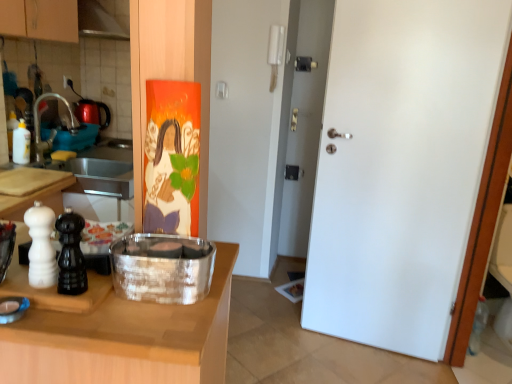
This screenshot has width=512, height=384. Find the location of `free space to the left of silver metallic container at center`. free space to the left of silver metallic container at center is located at coordinates (78, 292).